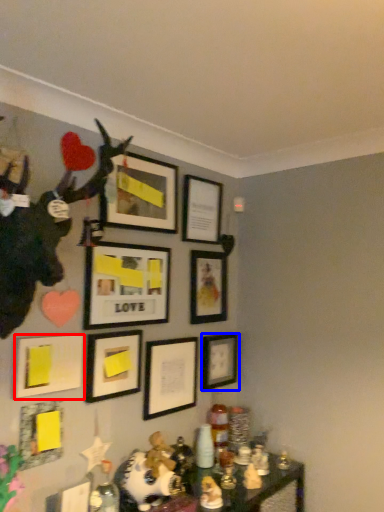
Question: Which of the following is the farthest to the observer, picture frame (highlighted by a red box) or picture frame (highlighted by a blue box)?

Choices:
 (A) picture frame
 (B) picture frame

Answer: (B)